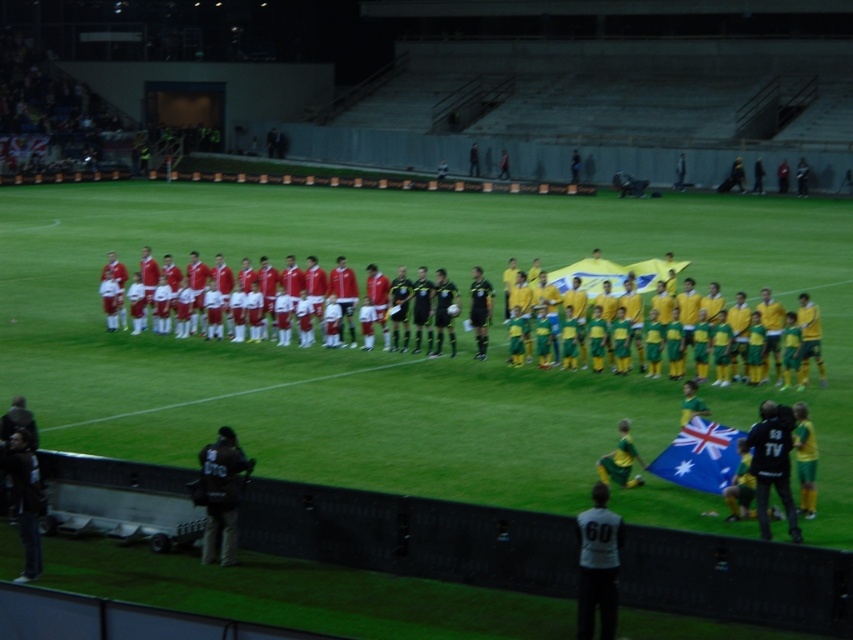
You are a photographer positioned at the center of the field during the nighttime soccer match. You want to capture a photo that includes both the blue fabric flag at lower right and the Australian flag mentioned in the scene. Which flag should you adjust your camera angle to focus on first to ensure both are in the frame?

The blue fabric flag at lower right is located at point (699,456), so you should focus on the blue fabric flag at lower right first as it is positioned further to the right and lower down, ensuring both flags are within the camera frame.

You are a photographer at the soccer match. You want to capture a photo that includes both the blue fabric flag at lower right and the matte red uniform at center. Based on their positions, will the flag block the view of the uniform in the photo?

The blue fabric flag at lower right is in front of the matte red uniform at center, so the flag will block the view of the uniform in the photo.